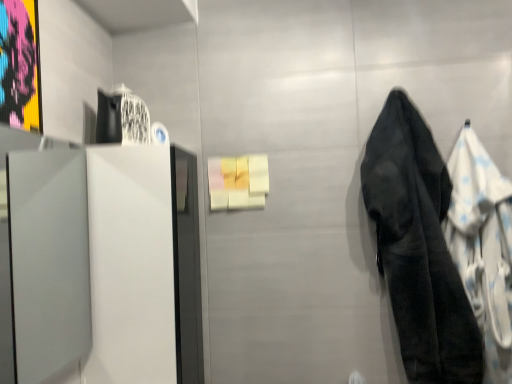
Question: Does black fabric towel at right have a greater height compared to black fabric coat at right?

Choices:
 (A) no
 (B) yes

Answer: (B)

Question: From a real-world perspective, is black fabric towel at right positioned under black fabric coat at right based on gravity?

Choices:
 (A) no
 (B) yes

Answer: (A)

Question: Is black fabric towel at right far away from black fabric coat at right?

Choices:
 (A) no
 (B) yes

Answer: (A)

Question: Can you confirm if black fabric towel at right is thinner than black fabric coat at right?

Choices:
 (A) yes
 (B) no

Answer: (B)

Question: From the image's perspective, is black fabric towel at right beneath black fabric coat at right?

Choices:
 (A) yes
 (B) no

Answer: (B)

Question: Is the depth of black fabric towel at right less than that of black fabric coat at right?

Choices:
 (A) no
 (B) yes

Answer: (B)

Question: Are black fabric coat at right and black fabric towel at right located far from each other?

Choices:
 (A) yes
 (B) no

Answer: (B)

Question: Is black fabric coat at right smaller than black fabric towel at right?

Choices:
 (A) no
 (B) yes

Answer: (B)

Question: Does black fabric coat at right lie behind black fabric towel at right?

Choices:
 (A) no
 (B) yes

Answer: (B)

Question: Does black fabric coat at right appear on the left side of black fabric towel at right?

Choices:
 (A) yes
 (B) no

Answer: (B)

Question: Would you say black fabric coat at right is outside black fabric towel at right?

Choices:
 (A) no
 (B) yes

Answer: (B)

Question: Could black fabric towel at right be considered to be inside black fabric coat at right?

Choices:
 (A) yes
 (B) no

Answer: (B)

Question: Does point (474, 362) appear closer or farther from the camera than point (480, 241)?

Choices:
 (A) closer
 (B) farther

Answer: (A)